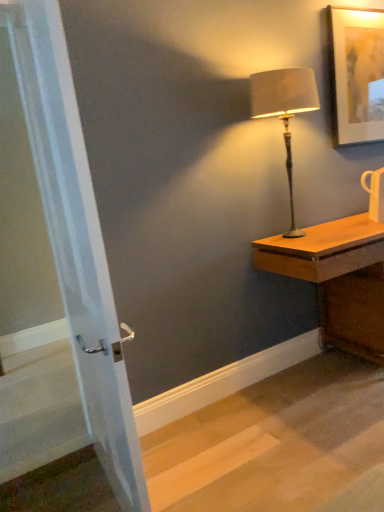
Question: From a real-world perspective, is wooden desk at right located beneath satin beige lampshade at right?

Choices:
 (A) yes
 (B) no

Answer: (A)

Question: Can you confirm if wooden desk at right is thinner than satin beige lampshade at right?

Choices:
 (A) no
 (B) yes

Answer: (A)

Question: Does wooden desk at right come behind satin beige lampshade at right?

Choices:
 (A) yes
 (B) no

Answer: (B)

Question: From a real-world perspective, is wooden desk at right positioned over satin beige lampshade at right based on gravity?

Choices:
 (A) yes
 (B) no

Answer: (B)

Question: Can you confirm if wooden desk at right is positioned to the left of satin beige lampshade at right?

Choices:
 (A) yes
 (B) no

Answer: (B)

Question: Looking at their shapes, would you say satin beige lampshade at right is wider or thinner than wooden desk at right?

Choices:
 (A) wide
 (B) thin

Answer: (B)

Question: From a real-world perspective, is satin beige lampshade at right above or below wooden desk at right?

Choices:
 (A) above
 (B) below

Answer: (A)

Question: Would you say satin beige lampshade at right is inside or outside wooden desk at right?

Choices:
 (A) inside
 (B) outside

Answer: (B)

Question: Is satin beige lampshade at right bigger or smaller than wooden desk at right?

Choices:
 (A) big
 (B) small

Answer: (B)

Question: From a real-world perspective, is white glossy mug at upper right physically located above or below matte white picture frame at upper right?

Choices:
 (A) below
 (B) above

Answer: (A)

Question: From the image's perspective, is white glossy mug at upper right located above or below matte white picture frame at upper right?

Choices:
 (A) above
 (B) below

Answer: (B)

Question: Is white glossy mug at upper right wider or thinner than matte white picture frame at upper right?

Choices:
 (A) thin
 (B) wide

Answer: (B)

Question: Choose the correct answer: Is white glossy mug at upper right inside matte white picture frame at upper right or outside it?

Choices:
 (A) outside
 (B) inside

Answer: (A)

Question: Considering the positions of white glossy mug at upper right and wooden desk at right in the image, is white glossy mug at upper right bigger or smaller than wooden desk at right?

Choices:
 (A) small
 (B) big

Answer: (A)

Question: Visually, is white glossy mug at upper right positioned to the left or to the right of wooden desk at right?

Choices:
 (A) right
 (B) left

Answer: (A)